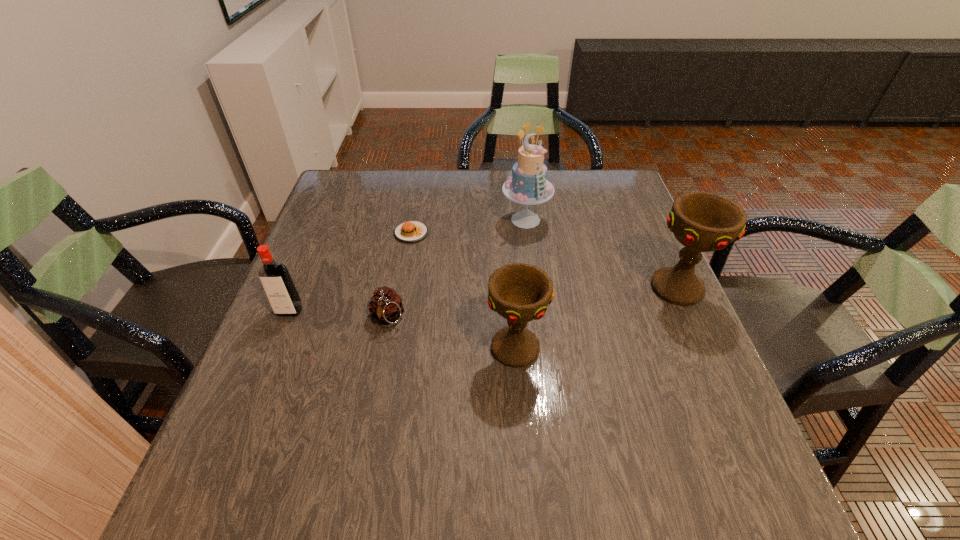
This screenshot has height=540, width=960. I want to click on the left chalice, so click(x=520, y=293).

What are the coordinates of `the nearer chalice` in the screenshot? It's located at (520, 293).

Locate an element on the screen. The height and width of the screenshot is (540, 960). the second tallest object is located at coordinates (702, 222).

Image resolution: width=960 pixels, height=540 pixels. Identify the location of the rightmost object. (702, 222).

I want to click on the shortest object, so click(x=411, y=231).

Image resolution: width=960 pixels, height=540 pixels. What are the coordinates of `the tallest object` in the screenshot? It's located at (528, 185).

This screenshot has height=540, width=960. What are the coordinates of `the second shortest object` in the screenshot? It's located at (385, 306).

I want to click on vodka, so click(280, 290).

In order to click on free spot located 0.350m on the left of the nearer chalice in this screenshot , I will do `click(319, 348)`.

Identify the location of free location located 0.280m on the left of the right chalice. (526, 288).